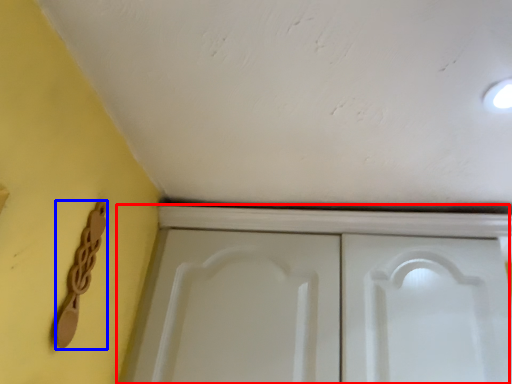
Question: Which object is closer to the camera taking this photo, cupboard (highlighted by a red box) or door handle (highlighted by a blue box)?

Choices:
 (A) cupboard
 (B) door handle

Answer: (B)